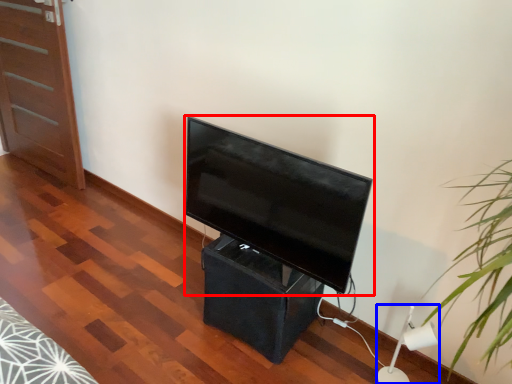
Question: Which point is closer to the camera, television (highlighted by a red box) or lamp (highlighted by a blue box)?

Choices:
 (A) television
 (B) lamp

Answer: (A)